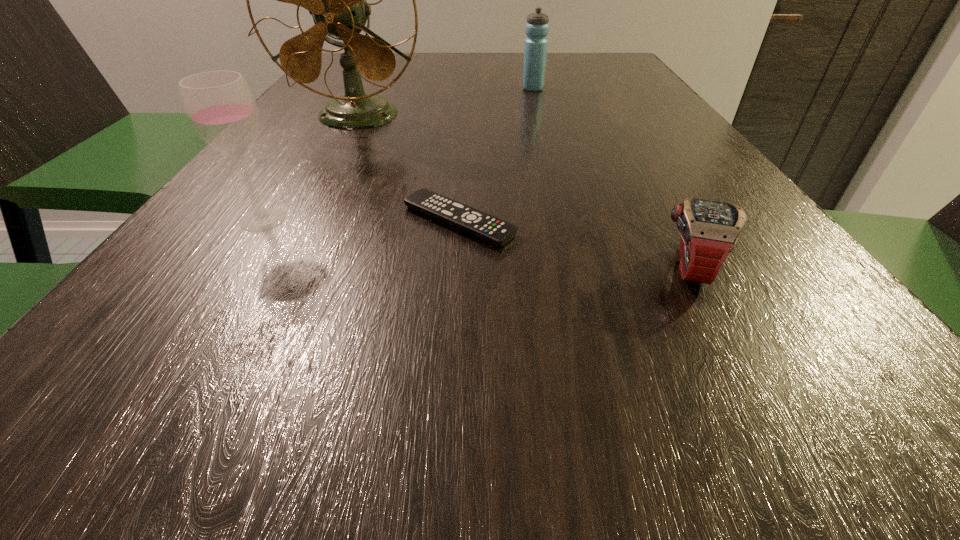
Where is `vacant space that is in between the fourth nearest object and the farthest object`? vacant space that is in between the fourth nearest object and the farthest object is located at coordinates (445, 102).

Locate an element on the screen. vacant area between the farthest object and the wineglass is located at coordinates (397, 154).

Find the location of a particular element. object that stands as the third closest to the second object from right to left is located at coordinates (709, 230).

Find the location of `object identified as the second closest to the second object from right to left`. object identified as the second closest to the second object from right to left is located at coordinates (489, 228).

Locate an element on the screen. This screenshot has height=540, width=960. vacant space that satisfies the following two spatial constraints: 1. on the front side of the shortest object; 2. on the right side of the watch is located at coordinates (456, 267).

Image resolution: width=960 pixels, height=540 pixels. Find the location of `vacant space that satisfies the following two spatial constraints: 1. on the back side of the remote control; 2. on the left side of the farthest object`. vacant space that satisfies the following two spatial constraints: 1. on the back side of the remote control; 2. on the left side of the farthest object is located at coordinates (468, 89).